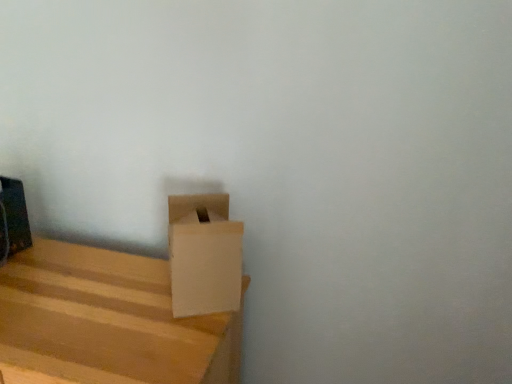
Where is `free region on the left part of white cardboard box at lower left`? Image resolution: width=512 pixels, height=384 pixels. free region on the left part of white cardboard box at lower left is located at coordinates (124, 290).